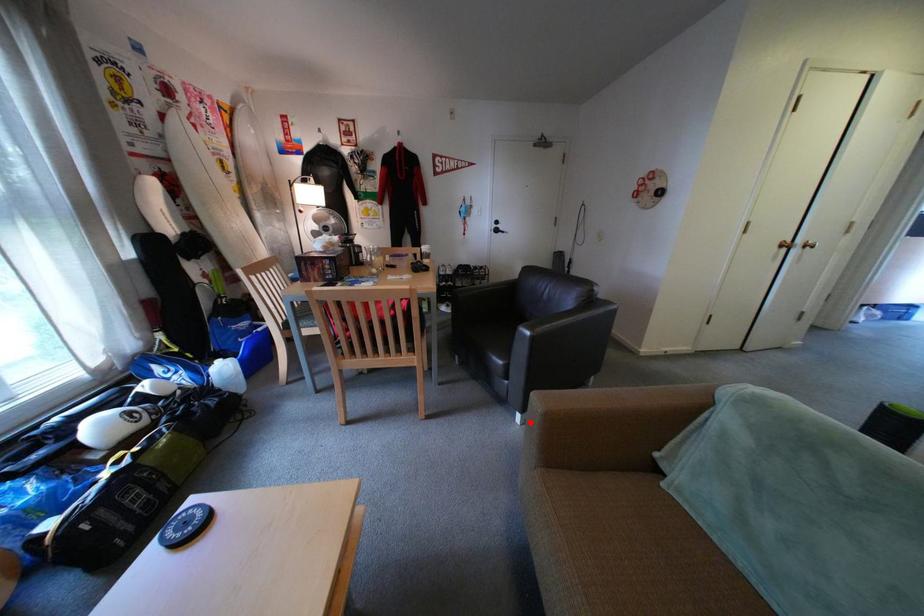
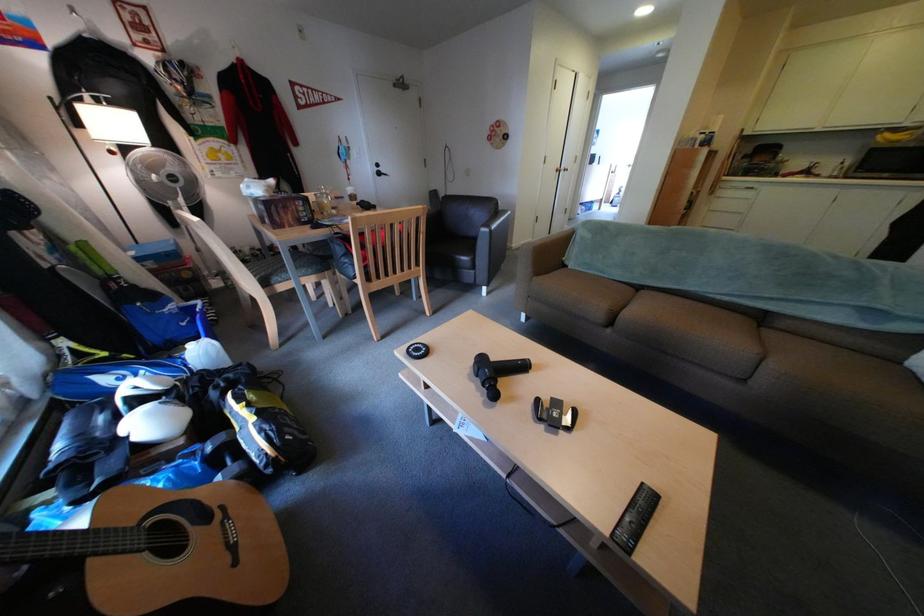
Locate, in the second image, the point that corresponds to the highlighted location in the first image.

(496, 296)